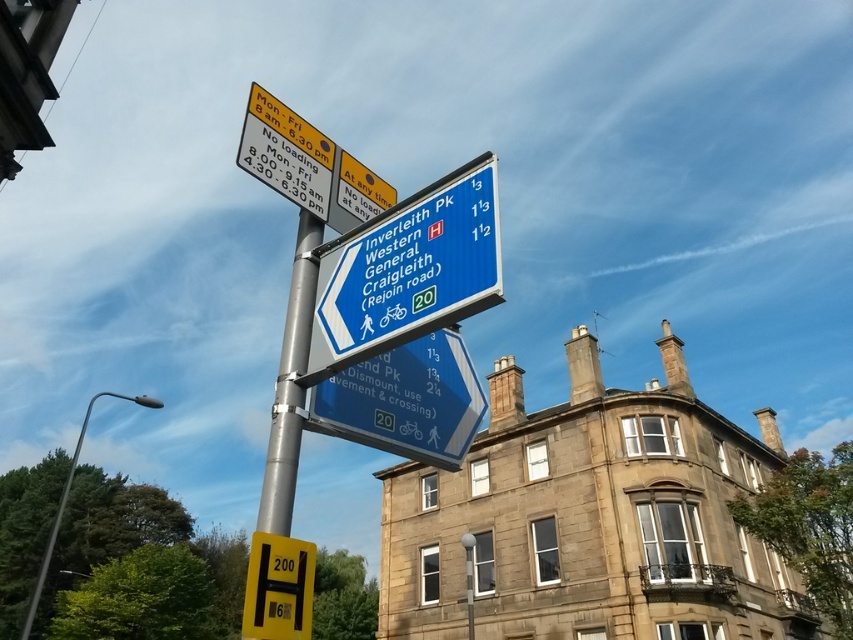
You are a delivery driver who needs to read both the blue plastic road sign at upper center and the blue plastic sign at upper center. Which one is taller?

The blue plastic road sign at upper center is taller than the blue plastic sign at upper center according to the description.

You are a delivery driver who needs to know the width of the blue plastic road sign at upper center and the yellow matte parking sign at lower left to ensure your truck can pass between them. According to the scene description, which sign is narrower?

The blue plastic road sign at upper center is thinner than the yellow matte parking sign at lower left, so the blue plastic road sign at upper center is narrower.